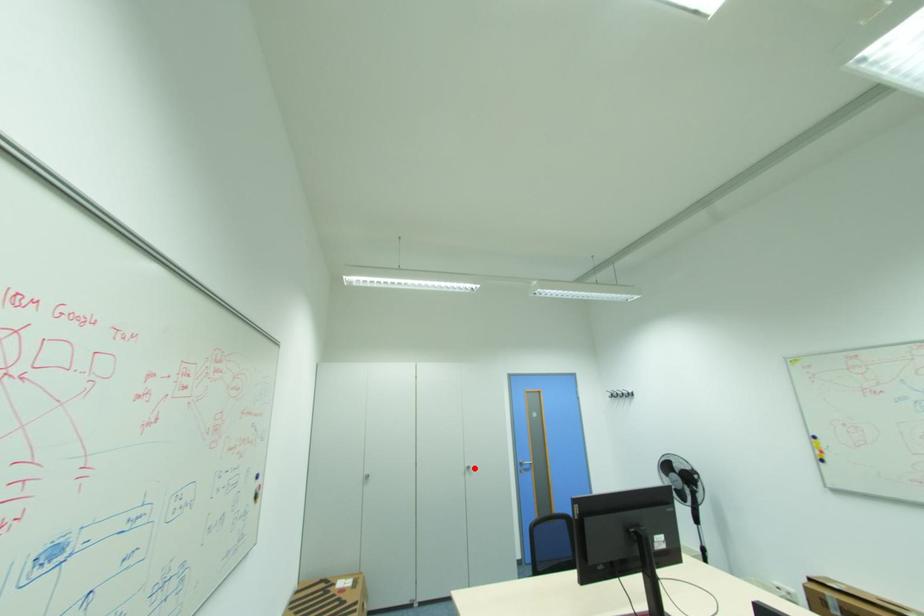
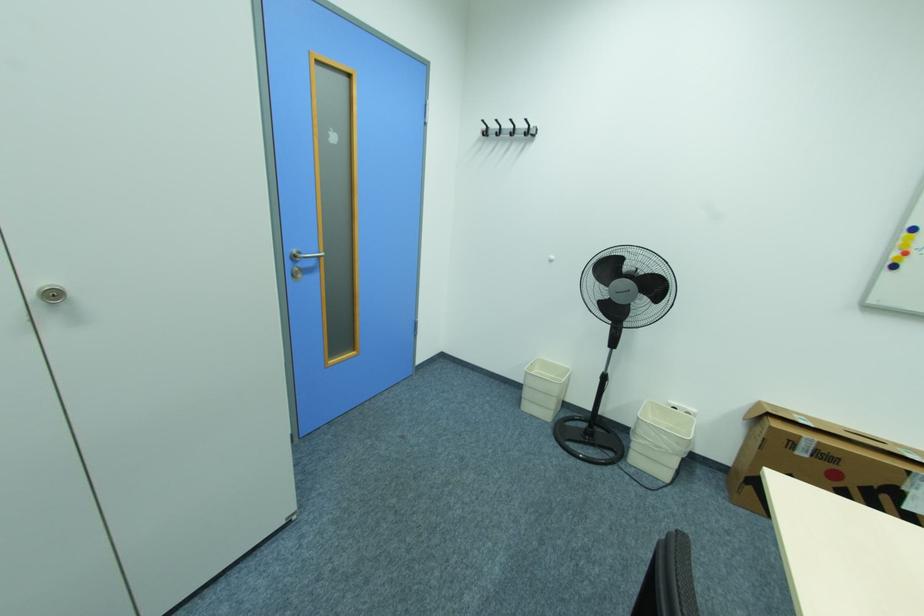
In the second image, find the point that corresponds to the highlighted location in the first image.

(64, 294)